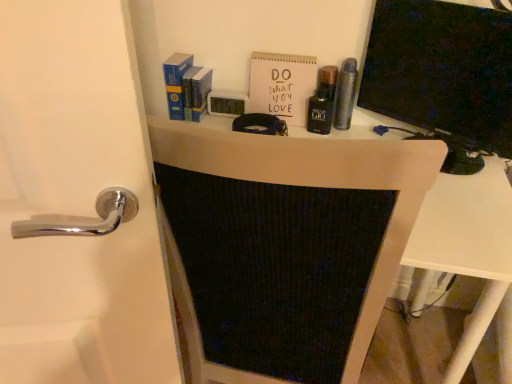
You are a GUI agent. You are given a task and a screenshot of the screen. Output one action in this format:
    pyautogui.click(x=<x>, y=<y>)
    Task: Click on the matte black monitor at center
    The image size is (512, 384).
    Given the screenshot: What is the action you would take?
    284,246

Where is `matte black monitor at right`? The width and height of the screenshot is (512, 384). matte black monitor at right is located at coordinates (443, 74).

Where is `black glass bottle at upper center, placed as the second toiletry when sorted from right to left`? This screenshot has height=384, width=512. black glass bottle at upper center, placed as the second toiletry when sorted from right to left is located at coordinates (322, 102).

The width and height of the screenshot is (512, 384). What do you see at coordinates (345, 94) in the screenshot?
I see `metallic silver canister at center, the first toiletry when ordered from right to left` at bounding box center [345, 94].

The image size is (512, 384). I want to click on matte black monitor at center, so click(284, 246).

Which object is further away from the camera, blue hardcover book at upper left or metallic silver canister at center, the first toiletry when ordered from right to left?

blue hardcover book at upper left is further away from the camera.

Is blue hardcover book at upper left aimed at metallic silver canister at center, the first toiletry when ordered from right to left?

No, blue hardcover book at upper left is not aimed at metallic silver canister at center, the first toiletry when ordered from right to left.

Is blue hardcover book at upper left to the left of metallic silver canister at center, the first toiletry when ordered from right to left, from the viewer's perspective?

Indeed, blue hardcover book at upper left is positioned on the left side of metallic silver canister at center, the first toiletry when ordered from right to left.

Between blue hardcover book at upper left and metallic silver canister at center, positioned as the 2th toiletry in left-to-right order, which one has larger size?

With larger size is blue hardcover book at upper left.

Is matte black monitor at center situated inside black glass bottle at upper center, the 1th toiletry from the left, or outside?

matte black monitor at center is spatially situated outside black glass bottle at upper center, the 1th toiletry from the left.

How much distance is there between matte black monitor at center and black glass bottle at upper center, placed as the second toiletry when sorted from right to left?

matte black monitor at center and black glass bottle at upper center, placed as the second toiletry when sorted from right to left, are 26.51 inches apart from each other.

From the image's perspective, is matte black monitor at center on top of black glass bottle at upper center, the 1th toiletry from the left?

No, from the image's perspective, matte black monitor at center is not above black glass bottle at upper center, the 1th toiletry from the left.

Based on the photo, could you tell me if blue hardcover book at upper left is facing matte black monitor at center?

No, blue hardcover book at upper left is not oriented towards matte black monitor at center.

This screenshot has height=384, width=512. Find the location of `furniture that appears below the blue hardcover book at upper left (from a real-world perspective)`. furniture that appears below the blue hardcover book at upper left (from a real-world perspective) is located at coordinates (284, 246).

Between blue hardcover book at upper left and matte black monitor at center, which one has more height?

With more height is matte black monitor at center.

Does blue hardcover book at upper left have a smaller size compared to matte black monitor at center?

Yes, blue hardcover book at upper left is smaller than matte black monitor at center.

Based on the photo, between matte black monitor at right and blue hardcover book at upper left, which one has more height?

matte black monitor at right is taller.

Is matte black monitor at right inside or outside of blue hardcover book at upper left?

matte black monitor at right lies outside blue hardcover book at upper left.

From the image's perspective, is metallic silver canister at center, the first toiletry when ordered from right to left, on matte black monitor at center?

Indeed, from the image's perspective, metallic silver canister at center, the first toiletry when ordered from right to left, is shown above matte black monitor at center.

Which object is further away from the camera taking this photo, metallic silver canister at center, positioned as the 2th toiletry in left-to-right order, or matte black monitor at center?

metallic silver canister at center, positioned as the 2th toiletry in left-to-right order, is behind.

Is metallic silver canister at center, the first toiletry when ordered from right to left, aimed at matte black monitor at center?

No, metallic silver canister at center, the first toiletry when ordered from right to left, is not oriented towards matte black monitor at center.

Which of these two, metallic silver canister at center, the first toiletry when ordered from right to left, or matte black monitor at center, stands shorter?

Standing shorter between the two is metallic silver canister at center, the first toiletry when ordered from right to left.

From the image's perspective, is matte black monitor at center positioned above or below metallic silver canister at center, positioned as the 2th toiletry in left-to-right order?

matte black monitor at center is situated lower than metallic silver canister at center, positioned as the 2th toiletry in left-to-right order, in the image.

Does matte black monitor at center touch metallic silver canister at center, the first toiletry when ordered from right to left?

No, matte black monitor at center is not making contact with metallic silver canister at center, the first toiletry when ordered from right to left.

In the scene shown: Is matte black monitor at center bigger than metallic silver canister at center, the first toiletry when ordered from right to left?

Yes.

Considering the relative sizes of matte black monitor at center and metallic silver canister at center, the first toiletry when ordered from right to left, in the image provided, is matte black monitor at center shorter than metallic silver canister at center, the first toiletry when ordered from right to left,?

No, matte black monitor at center is not shorter than metallic silver canister at center, the first toiletry when ordered from right to left.

Looking at their sizes, would you say matte black monitor at center is wider or thinner than white matte paper at upper center?

Clearly, matte black monitor at center has more width compared to white matte paper at upper center.

Can you tell me how much matte black monitor at center and white matte paper at upper center differ in facing direction?

The angle between the facing direction of matte black monitor at center and the facing direction of white matte paper at upper center is 0.632 degrees.

Looking at the image, does matte black monitor at center seem bigger or smaller compared to white matte paper at upper center?

Considering their sizes, matte black monitor at center takes up more space than white matte paper at upper center.

From a real-world perspective, does matte black monitor at center sit lower than white matte paper at upper center?

Yes, from a real-world perspective, matte black monitor at center is below white matte paper at upper center.

Image resolution: width=512 pixels, height=384 pixels. I want to click on toiletry that appears above the blue hardcover book at upper left (from a real-world perspective), so click(345, 94).

The image size is (512, 384). I want to click on the 1st toiletry counting from the right of the matte black monitor at center, so click(322, 102).

When comparing their distances from black glass bottle at upper center, placed as the second toiletry when sorted from right to left, does matte black monitor at right or blue hardcover book at upper left seem further?

blue hardcover book at upper left is positioned further to the anchor black glass bottle at upper center, placed as the second toiletry when sorted from right to left.

Considering their positions, is matte black monitor at right positioned closer to white matte paper at upper center than blue hardcover book at upper left?

Based on the image, blue hardcover book at upper left appears to be nearer to white matte paper at upper center.

Considering their positions, is matte black monitor at center positioned closer to black glass bottle at upper center, placed as the second toiletry when sorted from right to left, than blue hardcover book at upper left?

blue hardcover book at upper left is positioned closer to the anchor black glass bottle at upper center, placed as the second toiletry when sorted from right to left.

Looking at the image, which one is located closer to blue hardcover book at upper left, black glass bottle at upper center, the 1th toiletry from the left, or matte black monitor at right?

The object closer to blue hardcover book at upper left is black glass bottle at upper center, the 1th toiletry from the left.

When comparing their distances from black glass bottle at upper center, the 1th toiletry from the left, does white matte paper at upper center or blue hardcover book at upper left seem closer?

white matte paper at upper center is positioned closer to the anchor black glass bottle at upper center, the 1th toiletry from the left.

Based on their spatial positions, is metallic silver canister at center, the first toiletry when ordered from right to left, or black glass bottle at upper center, the 1th toiletry from the left, closer to blue hardcover book at upper left?

Among the two, black glass bottle at upper center, the 1th toiletry from the left, is located nearer to blue hardcover book at upper left.

Consider the image. From the image, which object appears to be nearer to blue hardcover book at upper left, black glass bottle at upper center, the 1th toiletry from the left, or white matte paper at upper center?

white matte paper at upper center.

When comparing their distances from metallic silver canister at center, the first toiletry when ordered from right to left, does white matte paper at upper center or matte black monitor at center seem closer?

white matte paper at upper center.

The height and width of the screenshot is (384, 512). What are the coordinates of `paperback book situated between blue hardcover book at upper left and black glass bottle at upper center, placed as the second toiletry when sorted from right to left, from left to right` in the screenshot? It's located at (282, 85).

The image size is (512, 384). I want to click on paperback book situated between blue hardcover book at upper left and metallic silver canister at center, the first toiletry when ordered from right to left, from left to right, so click(282, 85).

Locate an element on the screen. toiletry between matte black monitor at right and matte black monitor at center vertically is located at coordinates (322, 102).

You are a GUI agent. You are given a task and a screenshot of the screen. Output one action in this format:
    pyautogui.click(x=<x>, y=<y>)
    Task: Click on the paperback book between blue hardcover book at upper left and matte black monitor at right from left to right
    This screenshot has height=384, width=512.
    Given the screenshot: What is the action you would take?
    coord(282,85)